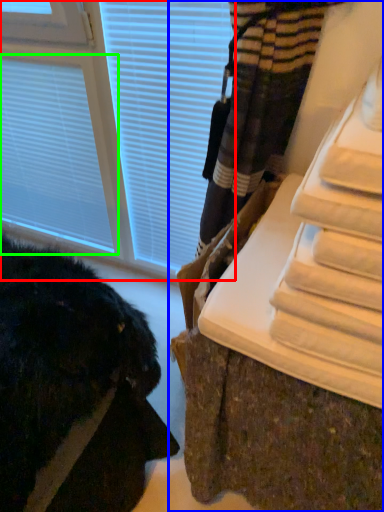
Question: Considering the real-world distances, which object is farthest from window (highlighted by a red box)? furniture (highlighted by a blue box) or blind (highlighted by a green box)?

Choices:
 (A) furniture
 (B) blind

Answer: (A)